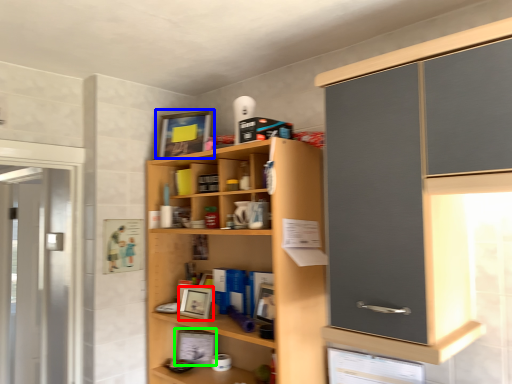
Question: Which is nearer to the picture frame (highlighted by a red box)? picture frame (highlighted by a blue box) or picture frame (highlighted by a green box).

Choices:
 (A) picture frame
 (B) picture frame

Answer: (B)